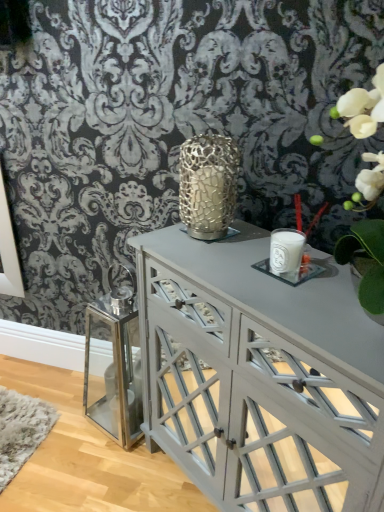
Question: From the image's perspective, is matte gray cabinet at center beneath white glass candle at center, marked as the 1th candle holder in a right-to-left arrangement?

Choices:
 (A) yes
 (B) no

Answer: (A)

Question: Would you consider matte gray cabinet at center to be distant from white glass candle at center, marked as the 2th candle holder in a top-to-bottom arrangement?

Choices:
 (A) yes
 (B) no

Answer: (B)

Question: Is matte gray cabinet at center with white glass candle at center, marked as the 2th candle holder in a top-to-bottom arrangement?

Choices:
 (A) yes
 (B) no

Answer: (B)

Question: Does matte gray cabinet at center have a lesser height compared to white glass candle at center, marked as the 2th candle holder in a top-to-bottom arrangement?

Choices:
 (A) yes
 (B) no

Answer: (B)

Question: Does matte gray cabinet at center lie in front of white glass candle at center, the second candle holder positioned from the left?

Choices:
 (A) no
 (B) yes

Answer: (B)

Question: Is white glass candle at center, marked as the 1th candle holder in a right-to-left arrangement, inside the boundaries of matte gray cabinet at center, or outside?

Choices:
 (A) outside
 (B) inside

Answer: (A)

Question: From the image's perspective, is white glass candle at center, the 1th candle holder ordered from the bottom, located above or below matte gray cabinet at center?

Choices:
 (A) above
 (B) below

Answer: (A)

Question: In the image, is white glass candle at center, marked as the 1th candle holder in a right-to-left arrangement, positioned in front of or behind matte gray cabinet at center?

Choices:
 (A) front
 (B) behind

Answer: (B)

Question: Is white glass candle at center, marked as the 1th candle holder in a right-to-left arrangement, bigger or smaller than matte gray cabinet at center?

Choices:
 (A) big
 (B) small

Answer: (B)

Question: In terms of width, does gold textured candle holder at center, arranged as the 2th candle holder when ordered from the bottom, look wider or thinner when compared to matte gray cabinet at center?

Choices:
 (A) thin
 (B) wide

Answer: (A)

Question: From the image's perspective, is gold textured candle holder at center, which is counted as the second candle holder, starting from the right, above or below matte gray cabinet at center?

Choices:
 (A) below
 (B) above

Answer: (B)

Question: Is gold textured candle holder at center, marked as the 1th candle holder in a top-to-bottom arrangement, taller or shorter than matte gray cabinet at center?

Choices:
 (A) tall
 (B) short

Answer: (B)

Question: Does point (223, 157) appear closer or farther from the camera than point (248, 293)?

Choices:
 (A) farther
 (B) closer

Answer: (A)

Question: From a real-world perspective, is gold textured candle holder at center, acting as the first candle holder starting from the left, above or below white glass candle at center, marked as the 2th candle holder in a top-to-bottom arrangement?

Choices:
 (A) below
 (B) above

Answer: (B)

Question: From the image's perspective, relative to white glass candle at center, marked as the 2th candle holder in a top-to-bottom arrangement, is gold textured candle holder at center, acting as the first candle holder starting from the left, above or below?

Choices:
 (A) below
 (B) above

Answer: (B)